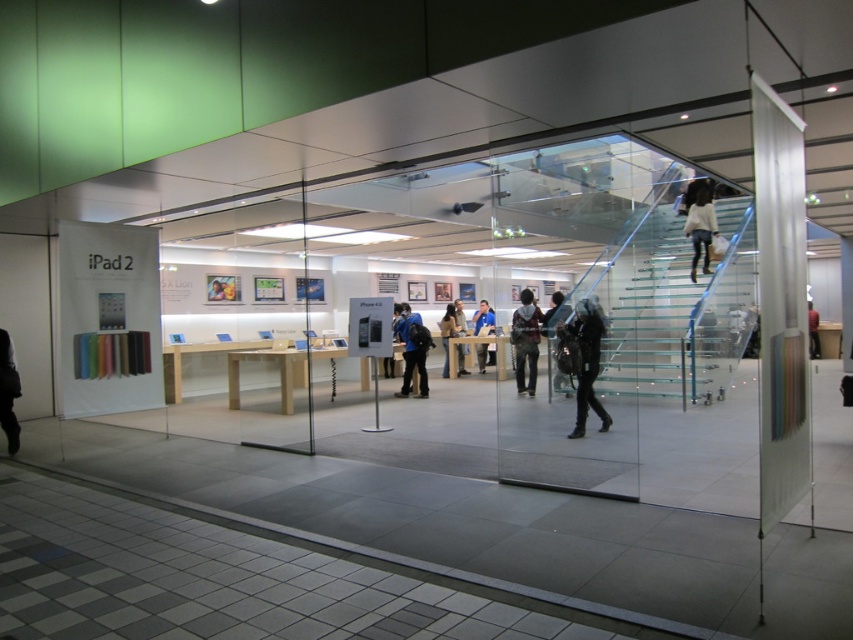
Which is below, transparent glass staircase at upper center or transparent glass stairs at upper center?

transparent glass stairs at upper center

Is point (735, 369) behind point (656, 374)?

Yes, point (735, 369) is farther from viewer.

Where is `transparent glass staircase at upper center`? This screenshot has height=640, width=853. transparent glass staircase at upper center is located at coordinates (624, 314).

Does dark gray leather jacket at center appear under blue fabric jacket at center?

Indeed, dark gray leather jacket at center is positioned under blue fabric jacket at center.

Looking at this image, who is positioned more to the left, dark gray leather jacket at center or blue fabric jacket at center?

blue fabric jacket at center

Which is behind, point (595, 401) or point (485, 305)?

Positioned behind is point (485, 305).

Where is `dark gray leather jacket at center`? Image resolution: width=853 pixels, height=640 pixels. dark gray leather jacket at center is located at coordinates (583, 360).

Is transparent glass staircase at upper center above light brown leather jacket at center?

Yes, transparent glass staircase at upper center is above light brown leather jacket at center.

Is point (701, 260) less distant than point (440, 330)?

Yes, it is in front of point (440, 330).

Between point (637, 189) and point (459, 372), which one is positioned in front?

Positioned in front is point (637, 189).

Image resolution: width=853 pixels, height=640 pixels. What are the coordinates of `transparent glass staircase at upper center` in the screenshot? It's located at (624, 314).